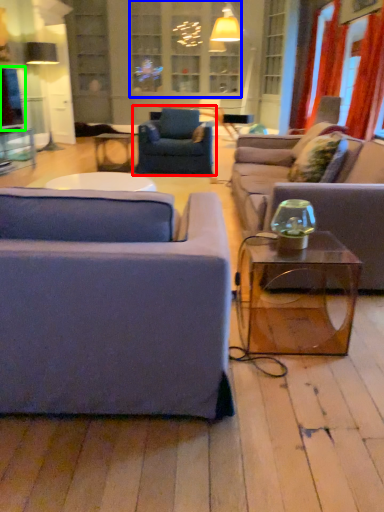
Question: Which object is the closest to the chair (highlighted by a red box)? Choose among these: window (highlighted by a blue box) or window screen (highlighted by a green box).

Choices:
 (A) window
 (B) window screen

Answer: (A)